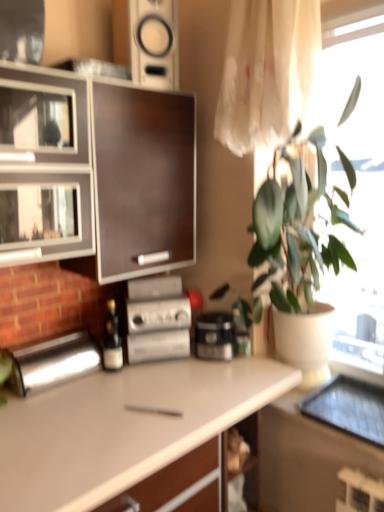
Where is `free point to the right of polished stainless steel bread bin at left, the 2th appliance positioned from the right`? free point to the right of polished stainless steel bread bin at left, the 2th appliance positioned from the right is located at coordinates (117, 385).